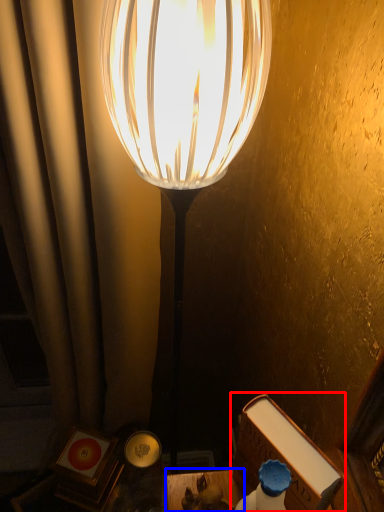
Question: Which point is closer to the camera, book (highlighted by a red box) or table (highlighted by a blue box)?

Choices:
 (A) book
 (B) table

Answer: (A)